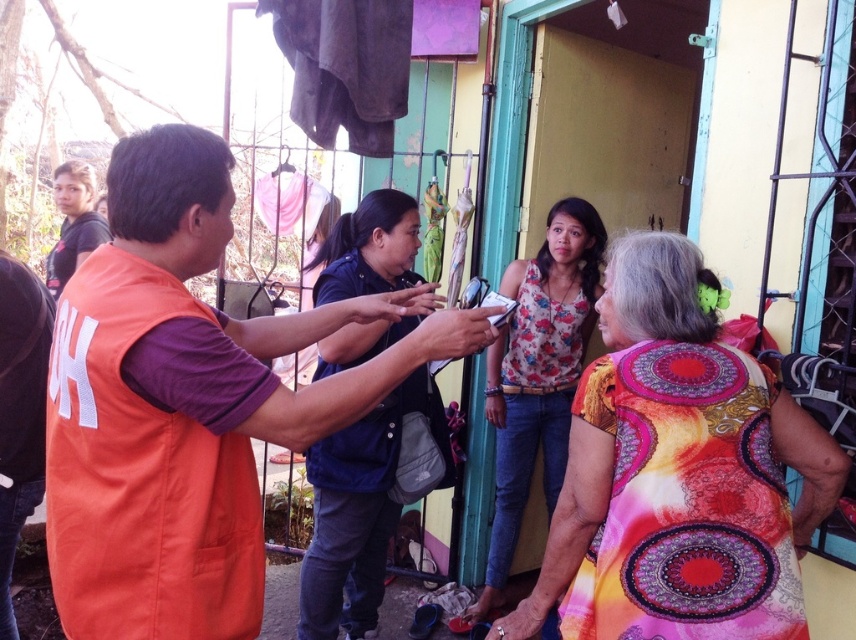
Locate an element on the screen. dark blue denim jacket at center is located at coordinates (358, 513).

Can you confirm if dark blue denim jacket at center is positioned below smooth leather bracelet at lower center?

Indeed, dark blue denim jacket at center is positioned under smooth leather bracelet at lower center.

Identify the location of dark blue denim jacket at center. The width and height of the screenshot is (856, 640). (358, 513).

Between dark blue denim jacket at center and smooth skin hand at center, which one appears on the right side from the viewer's perspective?

From the viewer's perspective, smooth skin hand at center appears more on the right side.

Can you confirm if dark blue denim jacket at center is positioned to the right of smooth skin hand at center?

No, dark blue denim jacket at center is not to the right of smooth skin hand at center.

Is point (349, 275) positioned in front of point (419, 346)?

No, (349, 275) is further to viewer.

Where is `dark blue denim jacket at center`? The width and height of the screenshot is (856, 640). dark blue denim jacket at center is located at coordinates (358, 513).

Find the location of a particular element. This screenshot has width=856, height=640. dark blue denim jacket at center is located at coordinates (358, 513).

Is dark blue denim jacket at center positioned behind floral fabric blouse at center?

No, dark blue denim jacket at center is in front of floral fabric blouse at center.

Where is `dark blue denim jacket at center`? dark blue denim jacket at center is located at coordinates (358, 513).